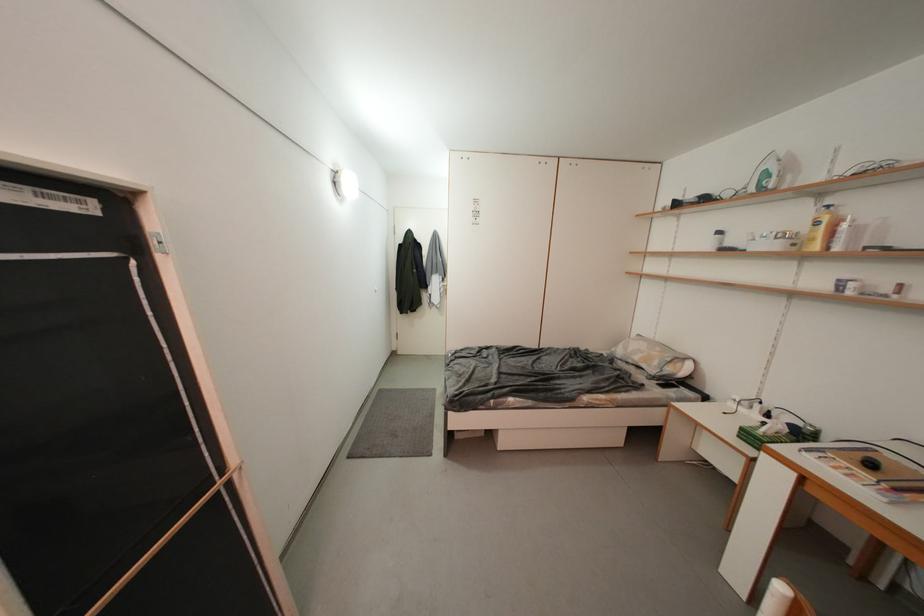
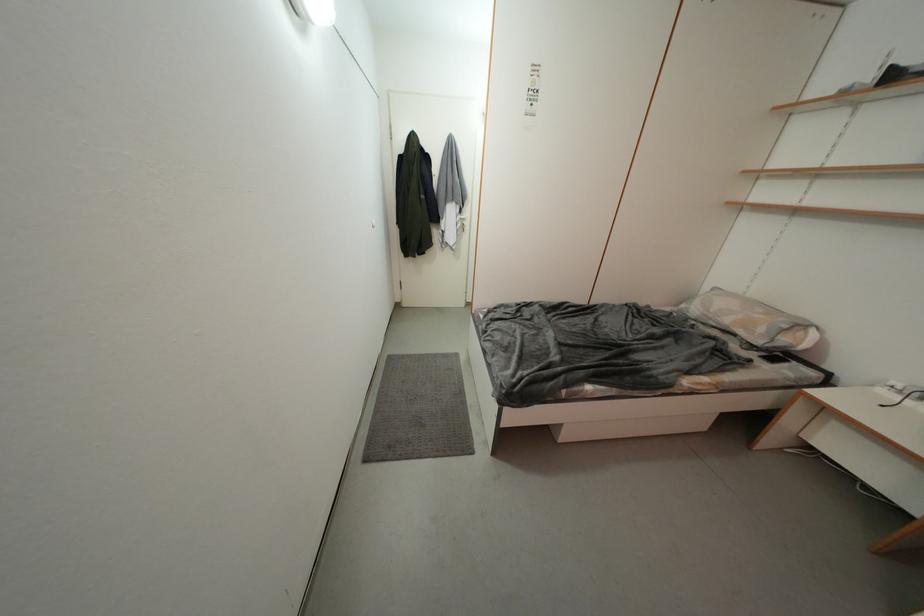
In the second image, find the point that corresponds to [663,367] in the first image.

(769, 333)